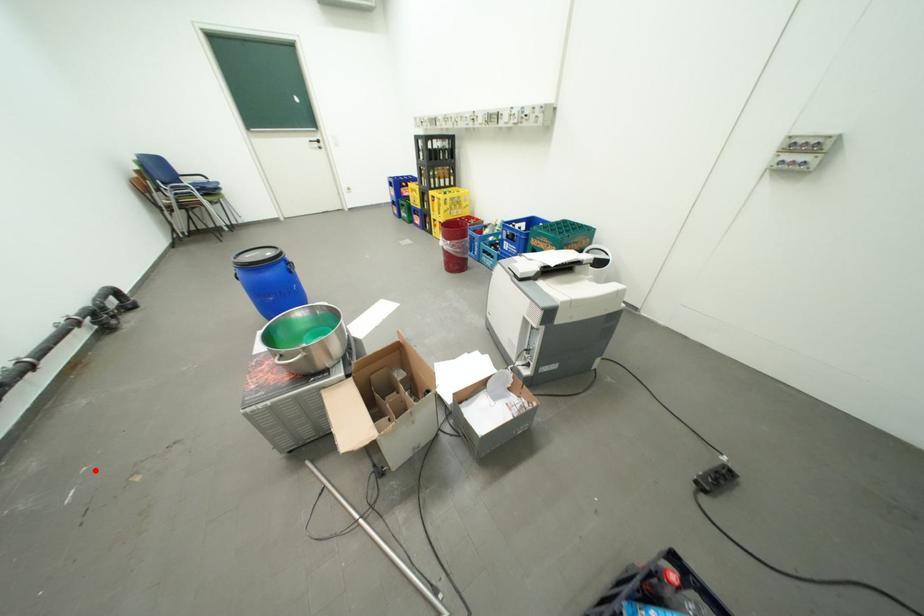
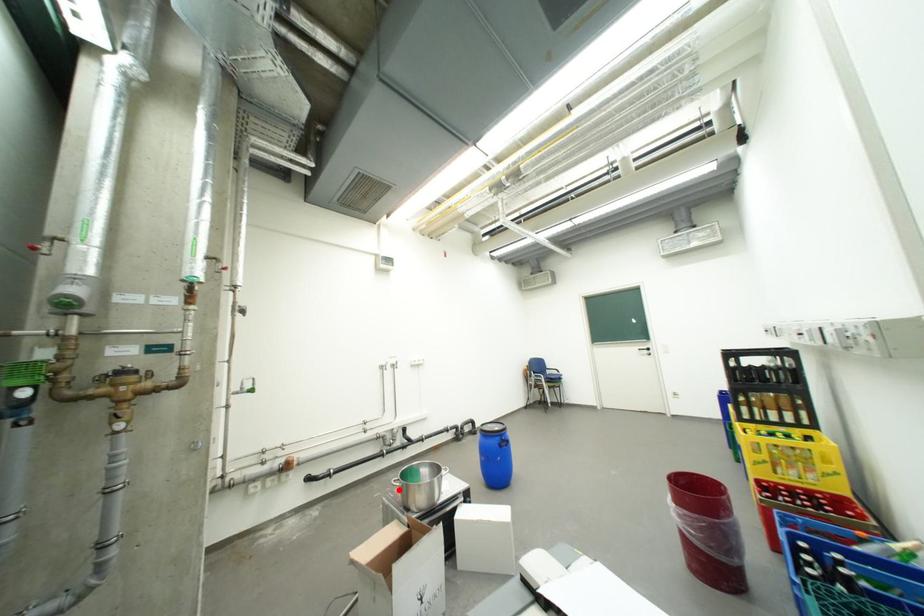
I am providing you with two images of the same scene from different viewpoints. A red point is marked on the first image and another point is marked on the second image. Are the points marked in image1 and image2 representing the same 3D position?

Yes